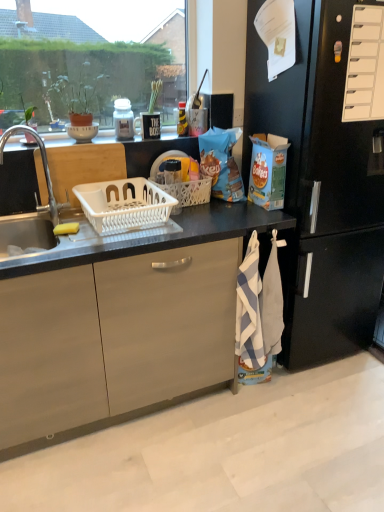
Question: Considering their positions, is clear glass window at upper left located in front of or behind wooden cutting board at upper center?

Choices:
 (A) behind
 (B) front

Answer: (B)

Question: Looking at their shapes, would you say clear glass window at upper left is wider or thinner than wooden cutting board at upper center?

Choices:
 (A) wide
 (B) thin

Answer: (B)

Question: Which is nearer to the silver metallic sink at left?

Choices:
 (A) yellow sponge at sink left
 (B) wooden cutting board at upper center
 (C) green leafy plant at upper left
 (D) white plastic basket at sink, which is the 2th picnic basket from right to left
 (E) clear glass window at upper left

Answer: (A)

Question: Estimate the real-world distances between objects in this image. Which object is closer to the white plastic basket at center, marked as the second picnic basket in a left-to-right arrangement?

Choices:
 (A) black matte refrigerator at right
 (B) white plastic basket at sink, which is the 2th picnic basket from right to left
 (C) silver metallic sink at left
 (D) blue striped towel at lower right
 (E) clear glass window at upper left

Answer: (B)